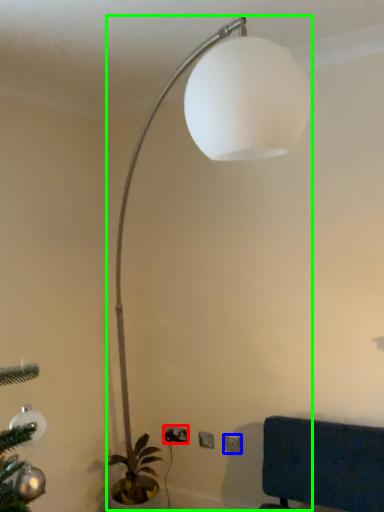
Question: Estimate the real-world distances between objects in this image. Which object is closer to electric outlet (highlighted by a red box), electric outlet (highlighted by a blue box) or lamp (highlighted by a green box)?

Choices:
 (A) electric outlet
 (B) lamp

Answer: (A)